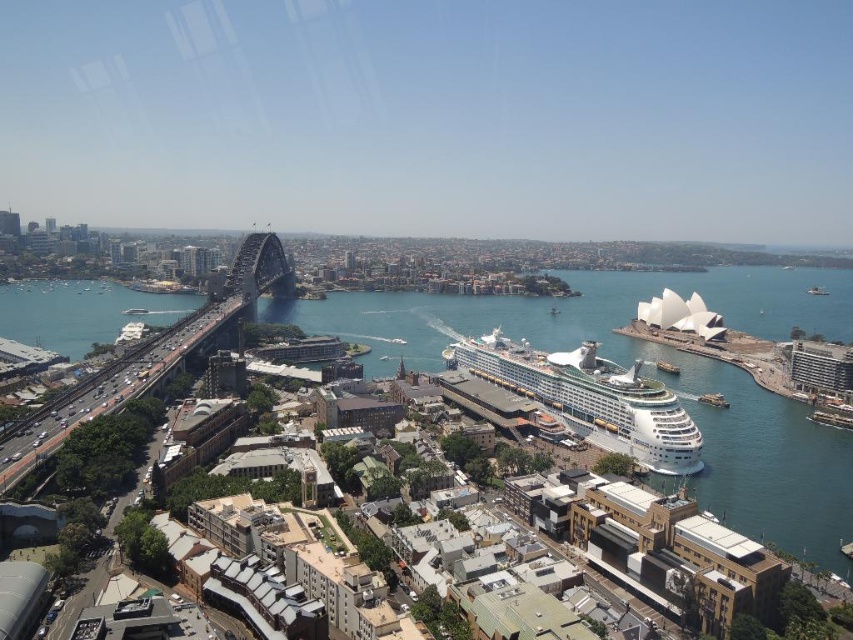
How much distance is there between clear blue water at center and white glossy cruise ship at center?

372.23 feet

Can you confirm if clear blue water at center is smaller than white glossy cruise ship at center?

Actually, clear blue water at center might be larger than white glossy cruise ship at center.

Measure the distance between point (x=743, y=456) and camera.

Point (x=743, y=456) is 219.55 meters away from camera.

The height and width of the screenshot is (640, 853). Find the location of `clear blue water at center`. clear blue water at center is located at coordinates (656, 378).

Between point (679, 433) and point (178, 317), which one is positioned in front?

Point (679, 433) is more forward.

Between point (601, 433) and point (224, 292), which one is positioned behind?

Point (224, 292)

Which is behind, point (641, 456) or point (178, 340)?

Point (178, 340)

The height and width of the screenshot is (640, 853). In order to click on white glossy cruise ship at center in this screenshot , I will do `click(590, 397)`.

Does clear blue water at center have a smaller size compared to metallic gray bridge at left?

Actually, clear blue water at center might be larger than metallic gray bridge at left.

Which of these two, clear blue water at center or metallic gray bridge at left, stands shorter?

metallic gray bridge at left

Is point (701, 380) farther from camera compared to point (283, 252)?

That is False.

Locate an element on the screen. Image resolution: width=853 pixels, height=640 pixels. clear blue water at center is located at coordinates (656, 378).